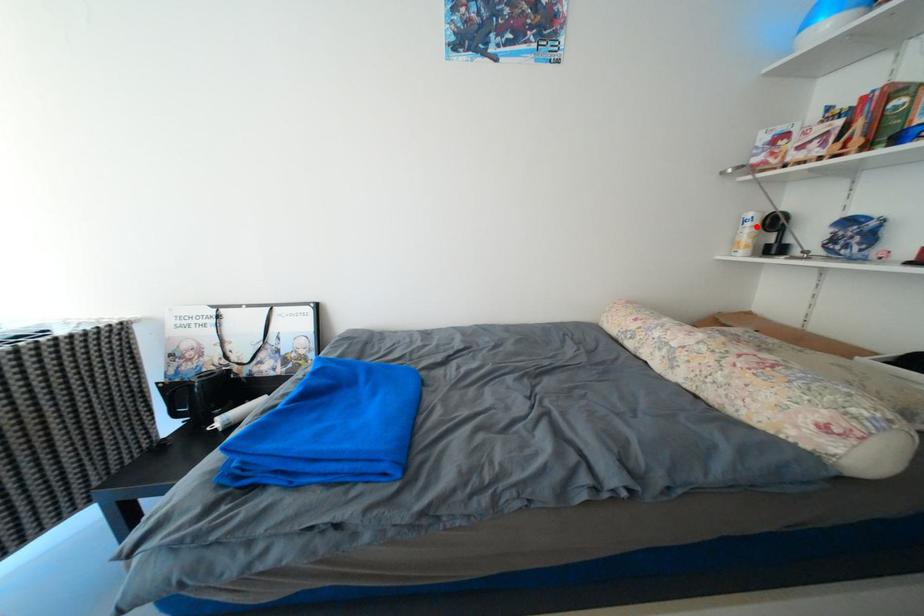
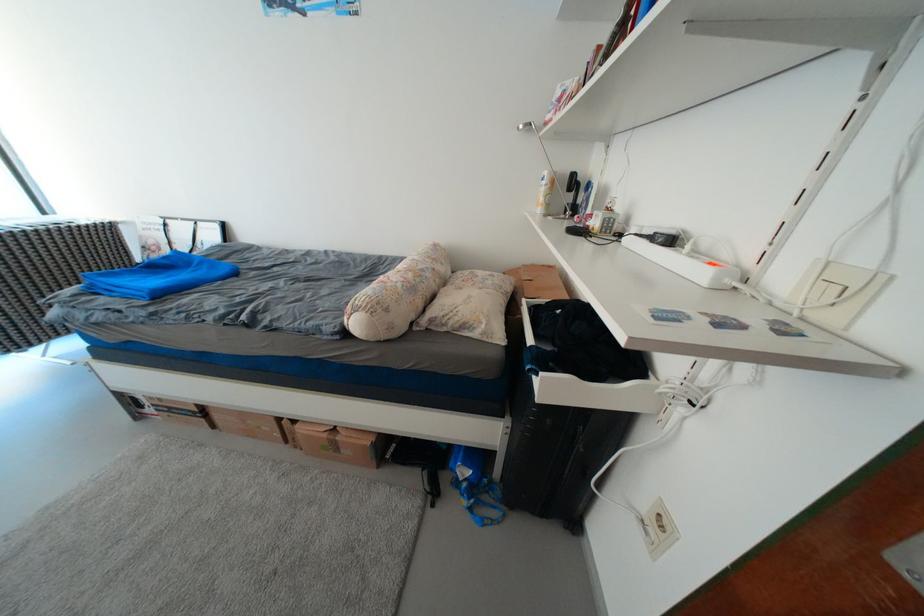
Question: I am providing you with two images of the same scene from different viewpoints. A red point is marked on the first image. Can you still see the location of the red point in image 2?

Choices:
 (A) Yes
 (B) No

Answer: (A)